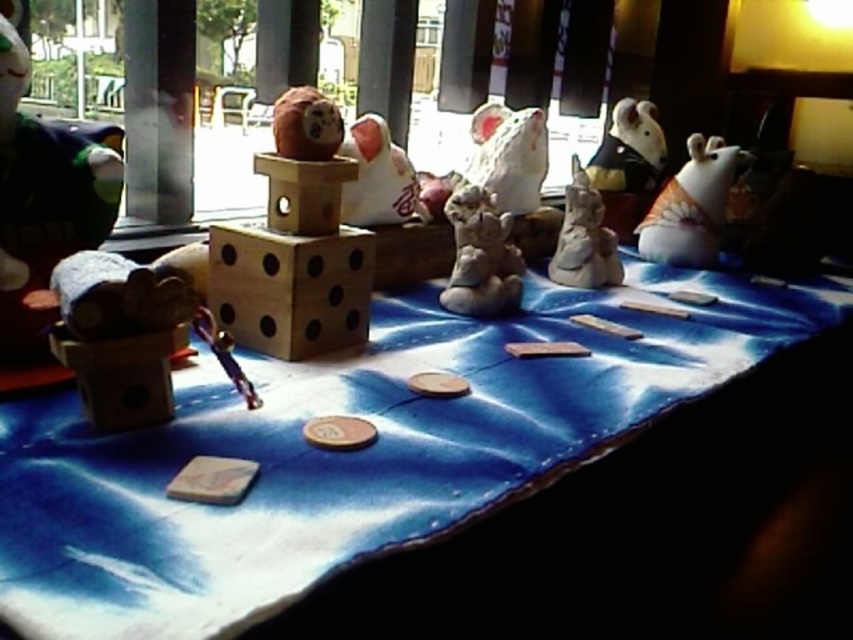
You are organizing a childrens party and have two bears on the table. The matte brown bear at left and the white glossy bear at upper right. Which bear is wider?

The white glossy bear at upper right is wider than the matte brown bear at left.

You are standing at a distance of 20 inches from the table. You want to reach the point marked as point (142,579) on the table. Can you reach it without moving your position?

The distance between point (142,579) and the camera is 15.94 inches. Since you are 20 inches away from the table, you can reach it without moving your position because the point is within your reach range.

You are setting up a game on the table and need to place a new figurine exactly at the center of the tablecloth. The current setup has the matte brown bear at left at position coordinates. Can you determine if the bear is positioned to the left or right of the tablecloth center?

The matte brown bear at left is located at point coordinates, which is to the left of the tablecloth center since its x coordinate is 0.312, which is less than 0.5. Therefore, the bear is positioned to the left of the center.